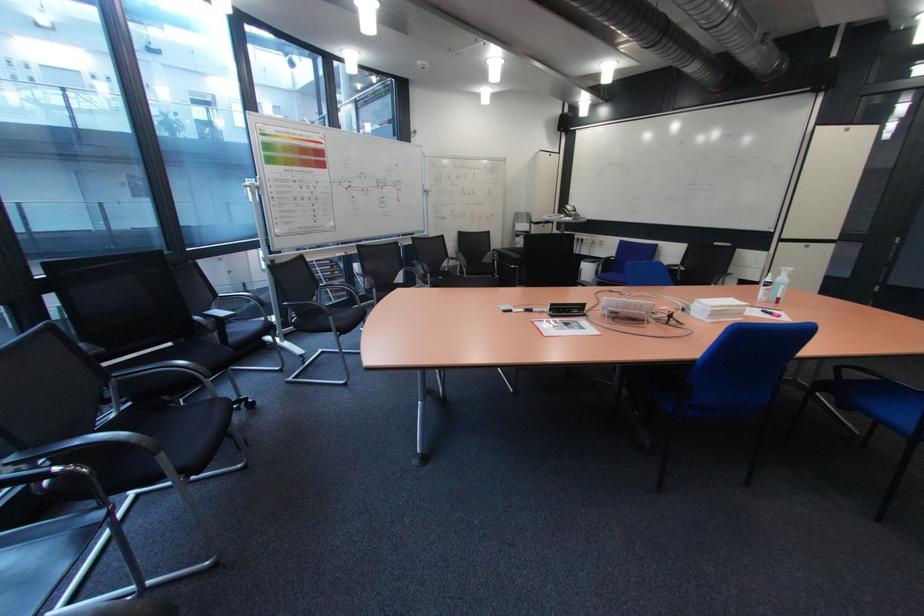
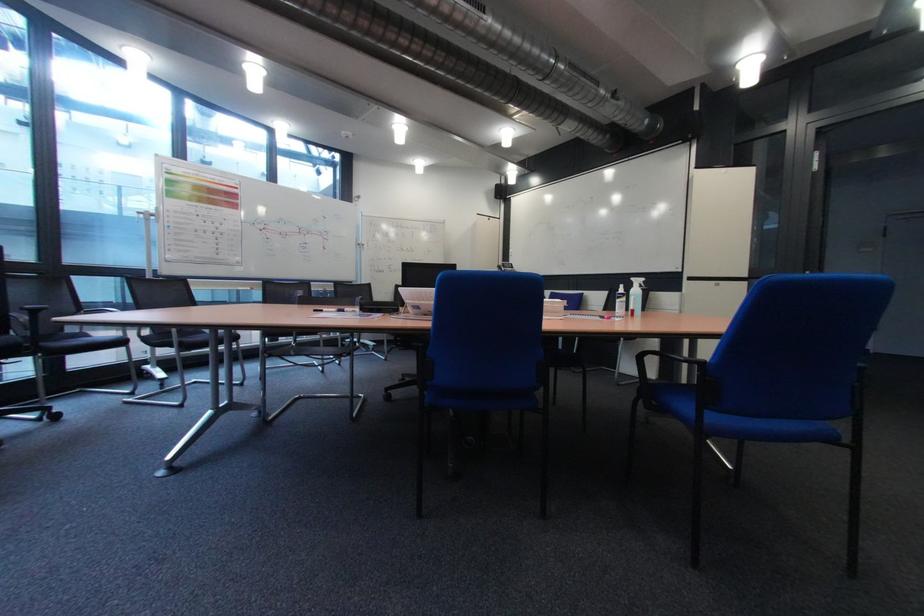
Question: What movement of the cameraman would produce the second image?

Choices:
 (A) Left
 (B) Right
 (C) Forward
 (D) Backward

Answer: (B)